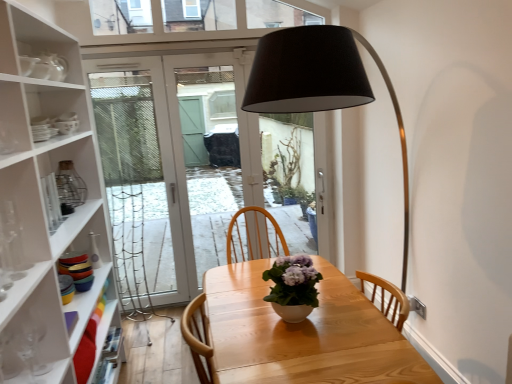
Question: Does matte white door at center have a larger size compared to white glossy vase at center?

Choices:
 (A) yes
 (B) no

Answer: (A)

Question: Are matte white door at center and white glossy vase at center far apart?

Choices:
 (A) no
 (B) yes

Answer: (B)

Question: Is matte white door at center thinner than white glossy vase at center?

Choices:
 (A) yes
 (B) no

Answer: (A)

Question: Considering the relative sizes of matte white door at center and white glossy vase at center in the image provided, is matte white door at center smaller than white glossy vase at center?

Choices:
 (A) yes
 (B) no

Answer: (B)

Question: Is matte white door at center positioned in front of white glossy vase at center?

Choices:
 (A) yes
 (B) no

Answer: (B)

Question: In terms of size, does matte white door at center appear bigger or smaller than clear glass vase at left?

Choices:
 (A) big
 (B) small

Answer: (A)

Question: In the image, is matte white door at center positioned in front of or behind clear glass vase at left?

Choices:
 (A) front
 (B) behind

Answer: (B)

Question: From the image's perspective, is matte white door at center positioned above or below clear glass vase at left?

Choices:
 (A) below
 (B) above

Answer: (B)

Question: In terms of width, does matte white door at center look wider or thinner when compared to clear glass vase at left?

Choices:
 (A) wide
 (B) thin

Answer: (B)

Question: Is point (266, 316) closer or farther from the camera than point (99, 109)?

Choices:
 (A) farther
 (B) closer

Answer: (B)

Question: Looking at their shapes, would you say light wood table at center is wider or thinner than matte white door at center?

Choices:
 (A) wide
 (B) thin

Answer: (A)

Question: From the image's perspective, relative to matte white door at center, is light wood table at center above or below?

Choices:
 (A) below
 (B) above

Answer: (A)

Question: Do you think light wood table at center is within matte white door at center, or outside of it?

Choices:
 (A) outside
 (B) inside

Answer: (A)

Question: Considering the positions of point (117, 59) and point (351, 367), is point (117, 59) closer or farther from the camera than point (351, 367)?

Choices:
 (A) closer
 (B) farther

Answer: (B)

Question: From the image's perspective, is matte white door at center positioned above or below light wood table at center?

Choices:
 (A) below
 (B) above

Answer: (B)